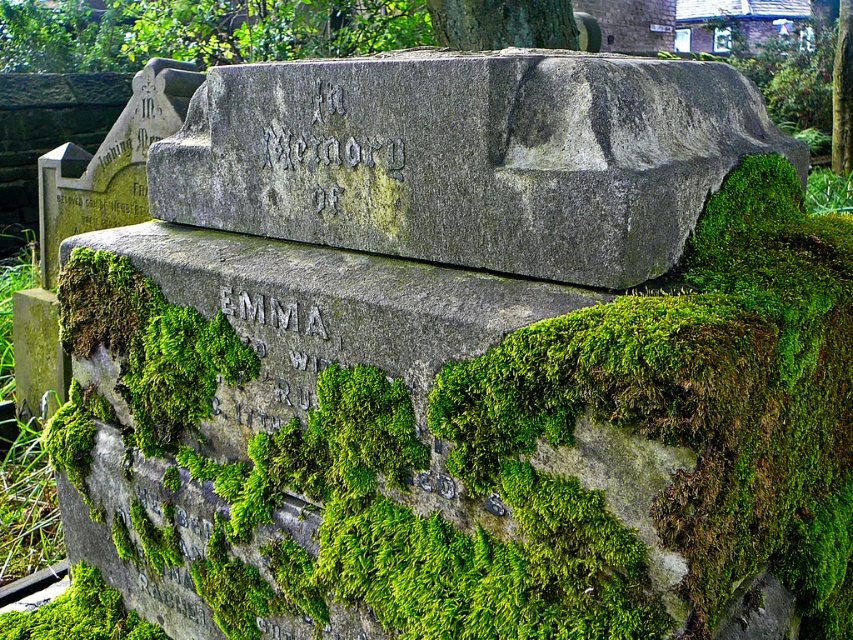
Is point (181, 243) more distant than point (410, 109)?

Yes, it is behind point (410, 109).

Who is more forward, (x=288, y=332) or (x=309, y=173)?

Point (x=288, y=332)

At what (x,y) coordinates should I click in order to perform the action: click on green mossy stone at center. Please return your answer as a coordinate pair (x, y). Image resolution: width=853 pixels, height=640 pixels. Looking at the image, I should click on (465, 433).